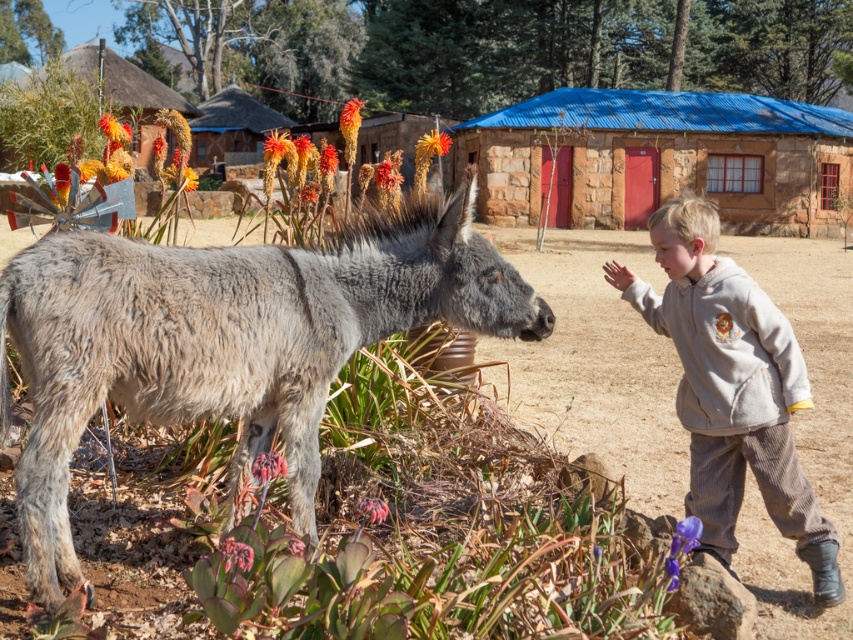
You are a photographer trying to capture a photo of the brown thatched hut at upper center. However, the light gray corduroy pants at right are blocking your view. Can you move the pants to the side to get a clear shot of the hut?

The light gray corduroy pants at right is closer to the viewer than the brown thatched hut at upper center, so you would need to move the pants to the side to get a clear view of the hut.

You are a photographer planning to take a photo of the gray fuzzy donkey at left and the brown thatched hut at upper center. Which object should you focus on first if you want to capture both in the same frame without moving the camera?

The gray fuzzy donkey at left is thinner than the brown thatched hut at upper center, so you should focus on the gray fuzzy donkey at left first as it requires less space in the frame to be captured clearly.

You are a photographer trying to capture the gray fuzzy donkey at left and the brown thatched hut at upper center in the same frame. Based on their positions, which object should you adjust your camera to focus on first to ensure both are in the shot?

The gray fuzzy donkey at left should be focused on first since it is positioned to the right of the brown thatched hut at upper center, so adjusting the camera to include the donkey on the right ensures the hut on the left is also captured.